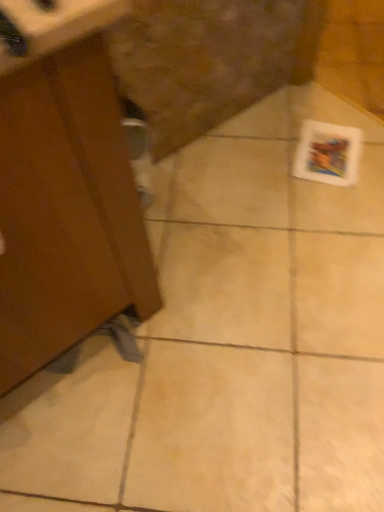
What do you see at coordinates (328, 153) in the screenshot?
I see `white glossy magazine at lower right` at bounding box center [328, 153].

Measure the distance between point (311, 156) and camera.

The distance of point (311, 156) from camera is 4.97 feet.

Locate an element on the screen. white glossy magazine at lower right is located at coordinates (328, 153).

The width and height of the screenshot is (384, 512). Identify the location of white glossy magazine at lower right. (328, 153).